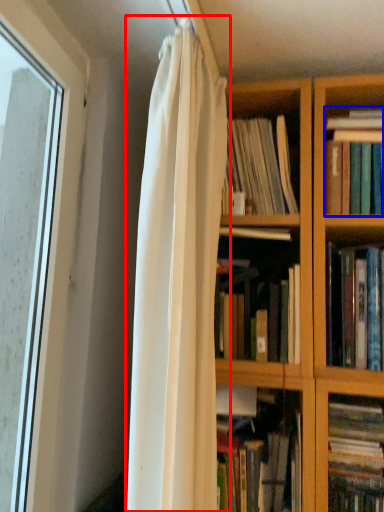
Question: Which point is further to the camera, curtain (highlighted by a red box) or book (highlighted by a blue box)?

Choices:
 (A) curtain
 (B) book

Answer: (B)